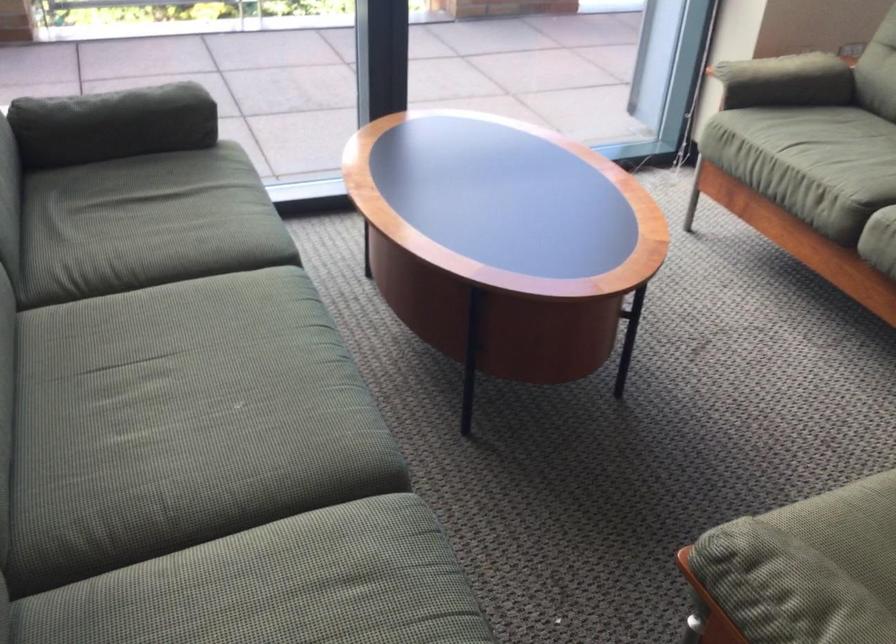
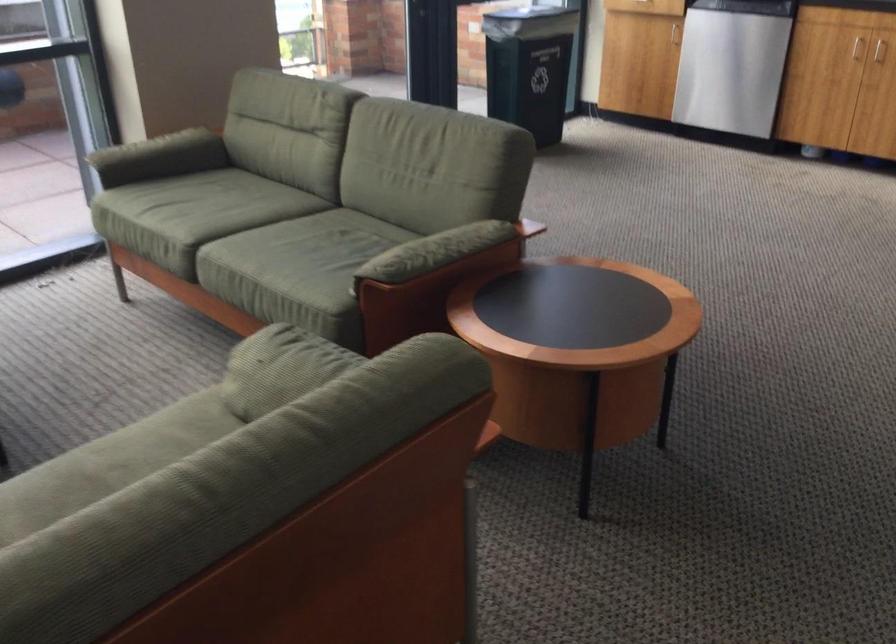
The images are taken continuously from a first-person perspective. In which direction are you moving?

The cameraman moved toward right, backward.